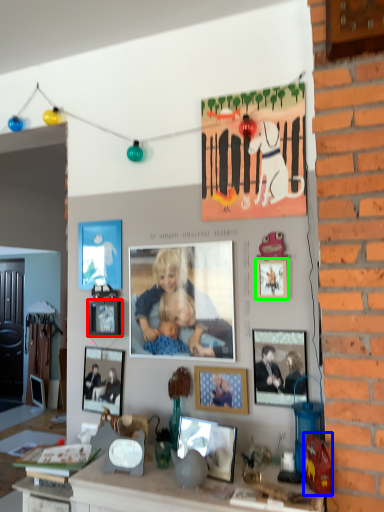
Question: Estimate the real-world distances between objects in this image. Which object is farther from picture frame (highlighted by a red box), toy (highlighted by a blue box) or picture frame (highlighted by a green box)?

Choices:
 (A) toy
 (B) picture frame

Answer: (A)